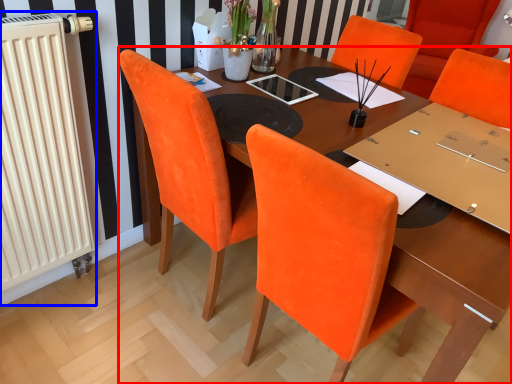
Question: Among these objects, which one is farthest to the camera, table (highlighted by a red box) or radiator (highlighted by a blue box)?

Choices:
 (A) table
 (B) radiator

Answer: (B)